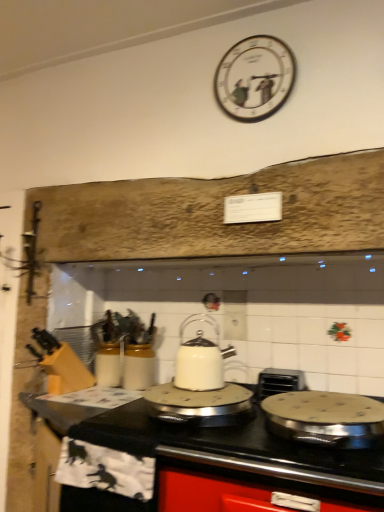
Question: Is white glossy kettle at center, the third kitchen appliance positioned from the right, not near white glossy kettle at center, which is the second kitchen appliance from right to left?

Choices:
 (A) yes
 (B) no

Answer: (B)

Question: Would you say white glossy kettle at center, placed as the 1th kitchen appliance when sorted from left to right, contains white glossy kettle at center, which is the second kitchen appliance from right to left?

Choices:
 (A) no
 (B) yes

Answer: (A)

Question: Is the depth of white glossy kettle at center, placed as the 1th kitchen appliance when sorted from left to right, less than that of white glossy kettle at center, which is the second kitchen appliance from right to left?

Choices:
 (A) no
 (B) yes

Answer: (B)

Question: Can you confirm if white glossy kettle at center, the third kitchen appliance positioned from the right, is positioned to the right of white glossy kettle at center, which is counted as the 2th kitchen appliance, starting from the left?

Choices:
 (A) no
 (B) yes

Answer: (A)

Question: Does white glossy kettle at center, the third kitchen appliance positioned from the right, have a smaller size compared to white glossy kettle at center, which is counted as the 2th kitchen appliance, starting from the left?

Choices:
 (A) yes
 (B) no

Answer: (B)

Question: Is the position of white glossy kettle at center, placed as the 1th kitchen appliance when sorted from left to right, more distant than that of white glossy kettle at center, which is the second kitchen appliance from right to left?

Choices:
 (A) yes
 (B) no

Answer: (B)

Question: Considering the relative sizes of white glossy countertop at center and white glossy kettle at center, placed as the 1th kitchen appliance when sorted from left to right, in the image provided, is white glossy countertop at center wider than white glossy kettle at center, placed as the 1th kitchen appliance when sorted from left to right,?

Choices:
 (A) no
 (B) yes

Answer: (B)

Question: Is white glossy countertop at center at the right side of white glossy kettle at center, placed as the 1th kitchen appliance when sorted from left to right?

Choices:
 (A) yes
 (B) no

Answer: (A)

Question: Is there a large distance between white glossy countertop at center and white glossy kettle at center, placed as the 1th kitchen appliance when sorted from left to right?

Choices:
 (A) no
 (B) yes

Answer: (A)

Question: Considering the relative positions of white glossy countertop at center and white glossy kettle at center, the third kitchen appliance positioned from the right, in the image provided, is white glossy countertop at center behind white glossy kettle at center, the third kitchen appliance positioned from the right,?

Choices:
 (A) yes
 (B) no

Answer: (B)

Question: Does white glossy countertop at center have a smaller size compared to white glossy kettle at center, the third kitchen appliance positioned from the right?

Choices:
 (A) no
 (B) yes

Answer: (A)

Question: Can we say white glossy countertop at center lies outside white glossy kettle at center, placed as the 1th kitchen appliance when sorted from left to right?

Choices:
 (A) yes
 (B) no

Answer: (A)

Question: Does white painted wood clock at upper center have a greater width compared to white glossy kettle at center, the third kitchen appliance positioned from the right?

Choices:
 (A) no
 (B) yes

Answer: (A)